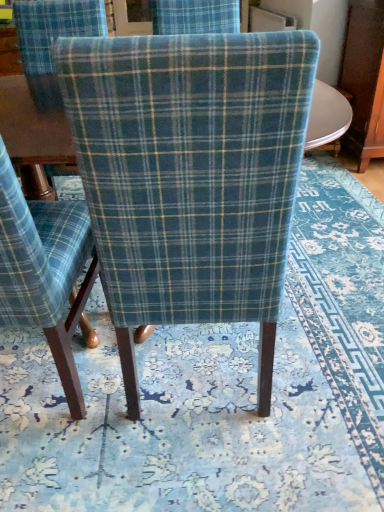
Question: Is blue plaid fabric chair at center, marked as the 1th chair in a left-to-right arrangement, oriented towards blue floral rug at center?

Choices:
 (A) yes
 (B) no

Answer: (B)

Question: Considering the relative positions of blue plaid fabric chair at center, marked as the 1th chair in a left-to-right arrangement, and blue floral rug at center in the image provided, is blue plaid fabric chair at center, marked as the 1th chair in a left-to-right arrangement, to the right of blue floral rug at center from the viewer's perspective?

Choices:
 (A) no
 (B) yes

Answer: (A)

Question: From the image's perspective, does blue plaid fabric chair at center, the second chair when ordered from right to left, appear lower than blue floral rug at center?

Choices:
 (A) yes
 (B) no

Answer: (A)

Question: From a real-world perspective, is blue plaid fabric chair at center, marked as the 1th chair in a left-to-right arrangement, positioned over blue floral rug at center based on gravity?

Choices:
 (A) no
 (B) yes

Answer: (B)

Question: Is blue plaid fabric chair at center, marked as the 1th chair in a left-to-right arrangement, closer to camera compared to blue floral rug at center?

Choices:
 (A) no
 (B) yes

Answer: (B)

Question: In the image, is plaid fabric chair at center, the first chair from the right, on the left side or the right side of blue floral rug at center?

Choices:
 (A) right
 (B) left

Answer: (B)

Question: Is plaid fabric chair at center, the first chair from the right, wider or thinner than blue floral rug at center?

Choices:
 (A) wide
 (B) thin

Answer: (B)

Question: Choose the correct answer: Is plaid fabric chair at center, the first chair from the right, inside blue floral rug at center or outside it?

Choices:
 (A) inside
 (B) outside

Answer: (B)

Question: From the image's perspective, is plaid fabric chair at center, acting as the 2th chair starting from the left, positioned above or below blue floral rug at center?

Choices:
 (A) above
 (B) below

Answer: (B)

Question: Choose the correct answer: Is blue floral rug at center inside blue plaid fabric chair at center, the second chair when ordered from right to left, or outside it?

Choices:
 (A) outside
 (B) inside

Answer: (A)

Question: From the image's perspective, relative to blue plaid fabric chair at center, marked as the 1th chair in a left-to-right arrangement, is blue floral rug at center above or below?

Choices:
 (A) above
 (B) below

Answer: (A)

Question: Is blue floral rug at center bigger or smaller than blue plaid fabric chair at center, marked as the 1th chair in a left-to-right arrangement?

Choices:
 (A) small
 (B) big

Answer: (A)

Question: Considering their positions, is blue floral rug at center located in front of or behind blue plaid fabric chair at center, the second chair when ordered from right to left?

Choices:
 (A) front
 (B) behind

Answer: (B)

Question: Considering their positions, is blue plaid fabric chair at center, marked as the 1th chair in a left-to-right arrangement, located in front of or behind blue floral rug at center?

Choices:
 (A) behind
 (B) front

Answer: (B)

Question: In the image, is blue plaid fabric chair at center, marked as the 1th chair in a left-to-right arrangement, on the left side or the right side of blue floral rug at center?

Choices:
 (A) left
 (B) right

Answer: (A)